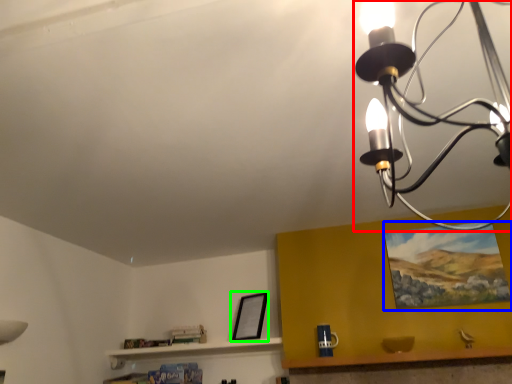
Question: Based on their relative distances, which object is farther from lamp (highlighted by a red box)? Choose from picture frame (highlighted by a blue box) and picture frame (highlighted by a green box).

Choices:
 (A) picture frame
 (B) picture frame

Answer: (B)